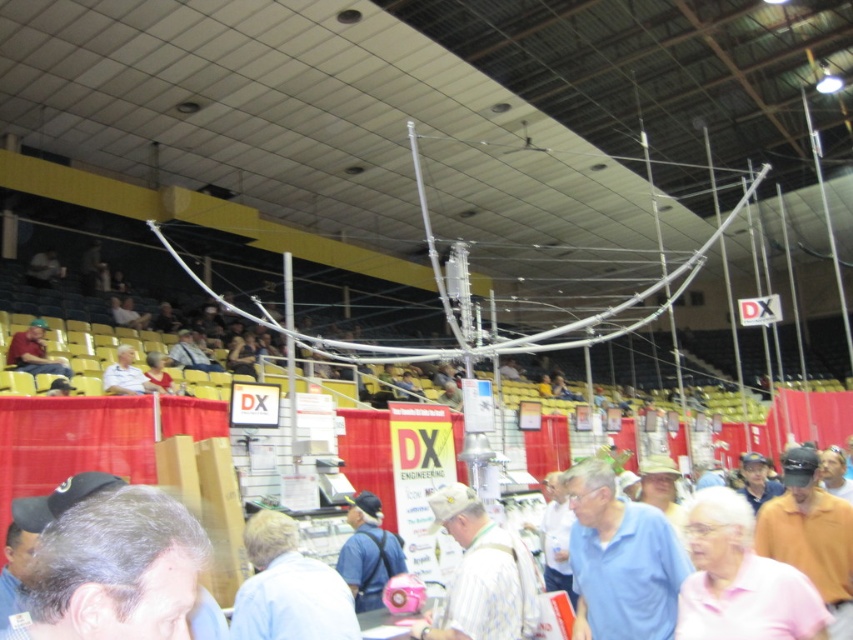
Question: Which of the following is the closest to the observer?

Choices:
 (A) blue cotton shirt at center
 (B) gray matte hair at lower left

Answer: (B)

Question: Considering the real-world distances, which object is farthest from the gray matte hair at lower left?

Choices:
 (A) tan fabric cap at center
 (B) blue cotton shirt at center
 (C) matte red shirt at left

Answer: (C)

Question: Does blue cotton shirt at center have a smaller size compared to matte red shirt at left?

Choices:
 (A) no
 (B) yes

Answer: (B)

Question: Which object is farther from the camera taking this photo?

Choices:
 (A) gray matte hair at lower left
 (B) light blue shirt at center
 (C) blue cotton shirt at center
 (D) blue fabric shirt at center

Answer: (D)

Question: Can you confirm if blue cotton shirt at center is positioned above pink matte shirt at lower right?

Choices:
 (A) no
 (B) yes

Answer: (A)

Question: Is blue cotton shirt at center bigger than pink matte shirt at lower right?

Choices:
 (A) yes
 (B) no

Answer: (A)